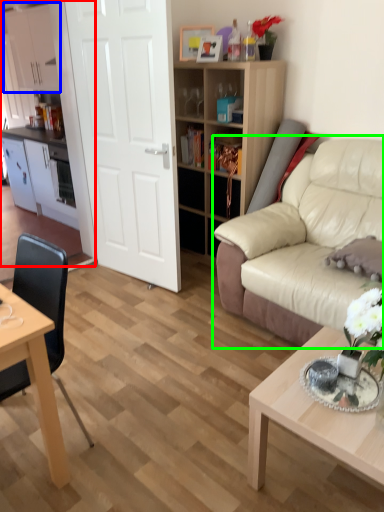
Question: Estimate the real-world distances between objects in this image. Which object is farther from entertainment center (highlighted by a red box), cabinetry (highlighted by a blue box) or studio couch (highlighted by a green box)?

Choices:
 (A) cabinetry
 (B) studio couch

Answer: (B)